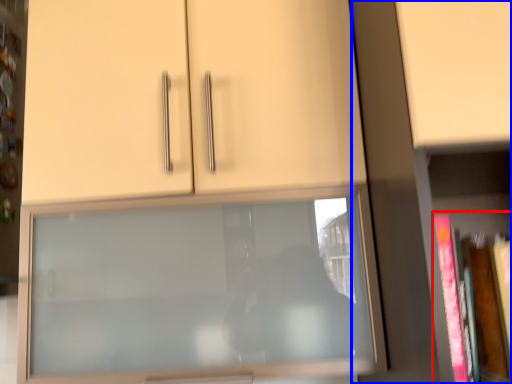
Question: Which object appears farthest to the camera in this image, book (highlighted by a red box) or bookcase (highlighted by a blue box)?

Choices:
 (A) book
 (B) bookcase

Answer: (A)